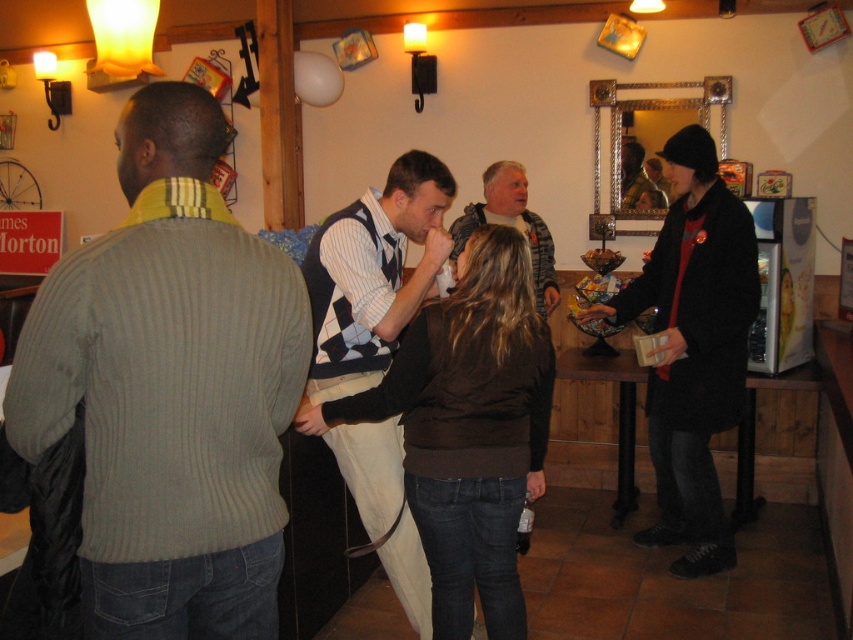
Question: Can you confirm if dark gray wool coat at right is smaller than gray sweater at center?

Choices:
 (A) no
 (B) yes

Answer: (A)

Question: Can you confirm if dark gray wool coat at right is thinner than gray sweater at center?

Choices:
 (A) no
 (B) yes

Answer: (A)

Question: Which point appears farthest from the camera in this image?

Choices:
 (A) (503, 227)
 (B) (461, 250)
 (C) (131, 432)
 (D) (699, 576)

Answer: (B)

Question: Among these points, which one is nearest to the camera?

Choices:
 (A) (743, 253)
 (B) (535, 454)

Answer: (B)

Question: Which object appears closest to the camera in this image?

Choices:
 (A) brown sweater at center
 (B) ribbed sweater at left

Answer: (B)

Question: Can you confirm if ribbed sweater at left is positioned to the left of brown sweater at center?

Choices:
 (A) yes
 (B) no

Answer: (A)